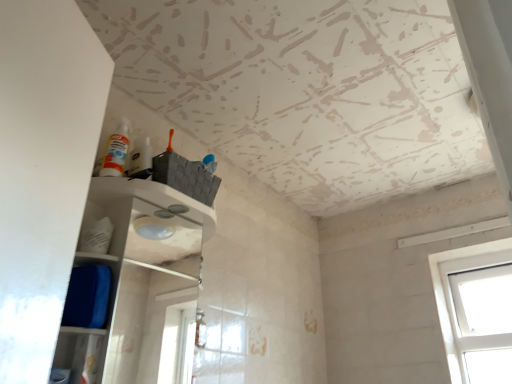
Where is `white glossy shelf at upper left`? The image size is (512, 384). white glossy shelf at upper left is located at coordinates (134, 285).

Measure the distance between point (102, 321) and camera.

A distance of 1.11 meters exists between point (102, 321) and camera.

What do you see at coordinates (134, 285) in the screenshot? I see `white glossy shelf at upper left` at bounding box center [134, 285].

At what (x,y) coordinates should I click in order to perform the action: click on white glossy shelf at upper left. Please return your answer as a coordinate pair (x, y). The image size is (512, 384). Looking at the image, I should click on (134, 285).